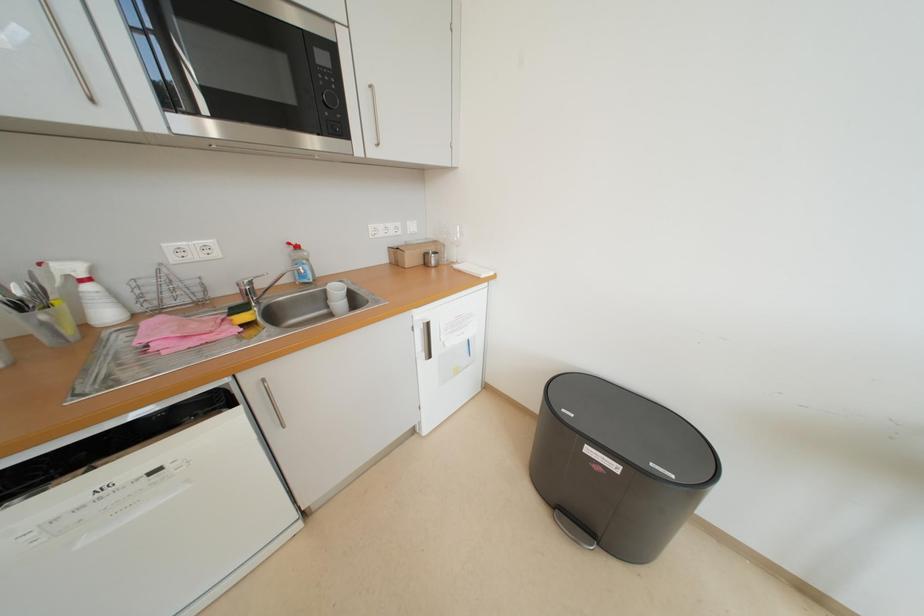
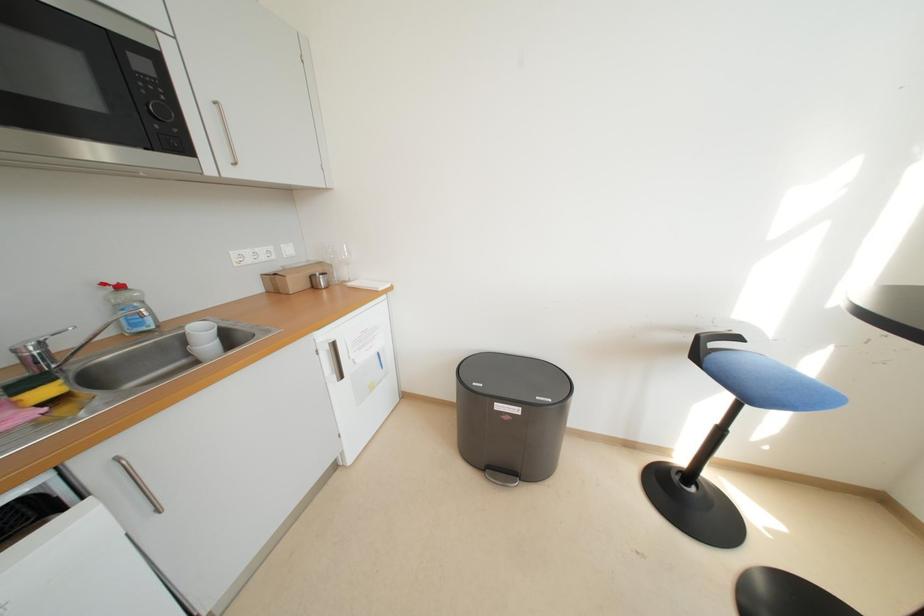
Which direction would the cameraman need to move to produce the second image?

The cameraman moved toward left, backward.